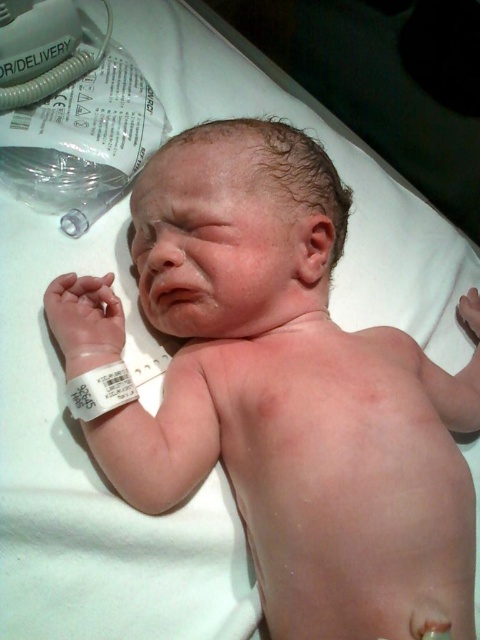
Question: Is smooth skin newborn at center thinner than white plastic bandage at lower left?

Choices:
 (A) no
 (B) yes

Answer: (A)

Question: Which of the following is the farthest from the observer?

Choices:
 (A) (225, 429)
 (B) (116, 374)

Answer: (A)

Question: Does smooth skin newborn at center have a larger size compared to white plastic bandage at lower left?

Choices:
 (A) no
 (B) yes

Answer: (B)

Question: From the image, what is the correct spatial relationship of smooth skin newborn at center in relation to white plastic bandage at lower left?

Choices:
 (A) left
 (B) right

Answer: (B)